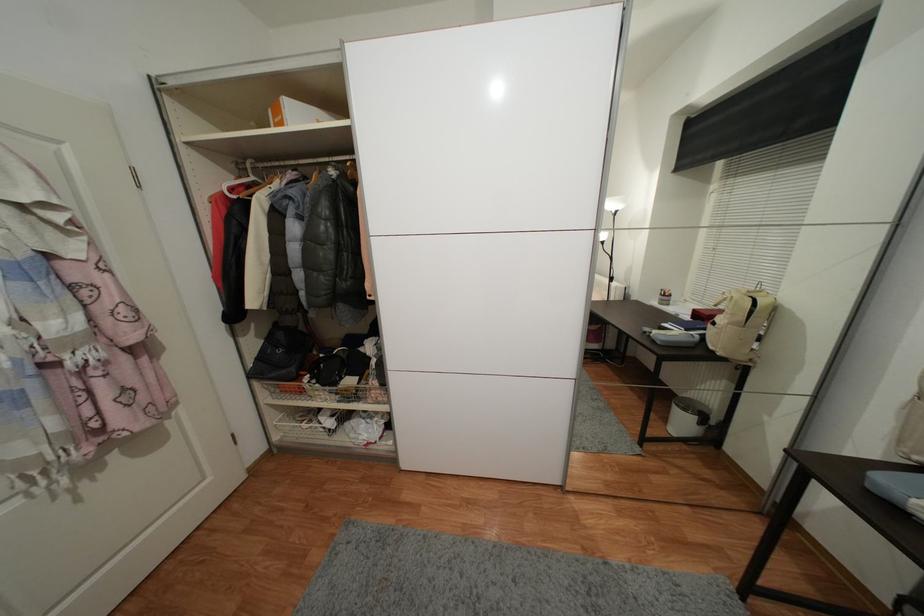
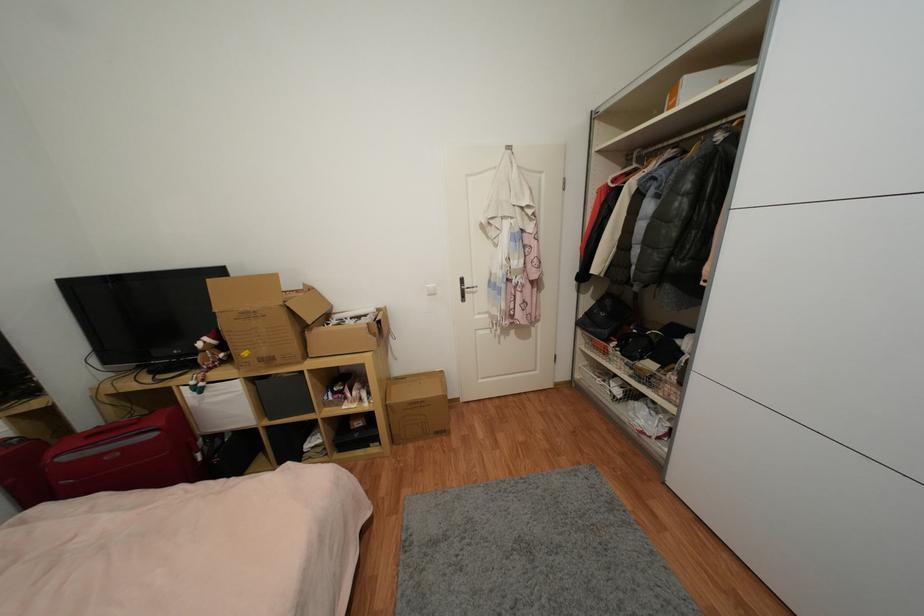
Where in the second image is the point corresponding to point (390, 410) from the first image?

(676, 410)